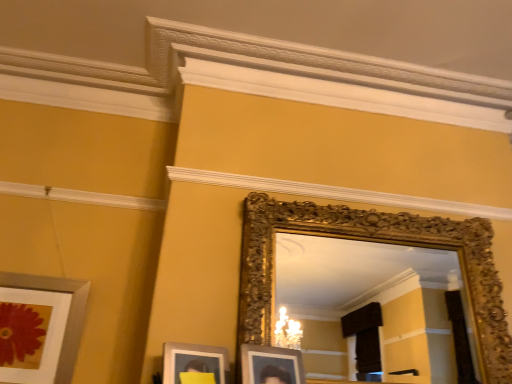
Question: Should I look upward or downward to see silver metallic picture frame at lower left?

Choices:
 (A) up
 (B) down

Answer: (B)

Question: Is gold ornate mirror at upper center wider than silver metallic picture frame at lower left?

Choices:
 (A) yes
 (B) no

Answer: (A)

Question: From the image's perspective, is gold ornate mirror at upper center located beneath silver metallic picture frame at lower left?

Choices:
 (A) yes
 (B) no

Answer: (B)

Question: Can you confirm if gold ornate mirror at upper center is thinner than silver metallic picture frame at lower left?

Choices:
 (A) no
 (B) yes

Answer: (A)

Question: Does gold ornate mirror at upper center touch silver metallic picture frame at lower left?

Choices:
 (A) no
 (B) yes

Answer: (A)

Question: Would you say gold ornate mirror at upper center contains silver metallic picture frame at lower left?

Choices:
 (A) no
 (B) yes

Answer: (A)

Question: Are gold ornate mirror at upper center and silver metallic picture frame at lower left located far from each other?

Choices:
 (A) yes
 (B) no

Answer: (A)

Question: From a real-world perspective, is silver metallic picture frame at lower left over gold ornate mirror at upper center?

Choices:
 (A) no
 (B) yes

Answer: (A)

Question: Would you consider silver metallic picture frame at lower left to be distant from gold ornate mirror at upper center?

Choices:
 (A) yes
 (B) no

Answer: (A)

Question: Is the surface of silver metallic picture frame at lower left in direct contact with gold ornate mirror at upper center?

Choices:
 (A) no
 (B) yes

Answer: (A)

Question: Is silver metallic picture frame at lower left closer to camera compared to gold ornate mirror at upper center?

Choices:
 (A) yes
 (B) no

Answer: (B)

Question: Considering the relative sizes of silver metallic picture frame at lower left and gold ornate mirror at upper center in the image provided, is silver metallic picture frame at lower left smaller than gold ornate mirror at upper center?

Choices:
 (A) no
 (B) yes

Answer: (B)

Question: From the image's perspective, is silver metallic picture frame at lower left located beneath gold ornate mirror at upper center?

Choices:
 (A) yes
 (B) no

Answer: (A)

Question: Is gold ornate mirror at upper center spatially inside silver metallic picture frame at lower left, or outside of it?

Choices:
 (A) inside
 (B) outside

Answer: (B)